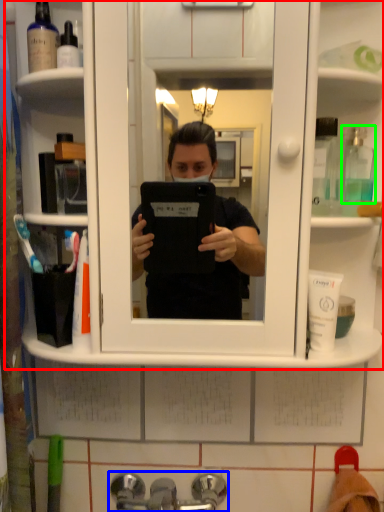
Question: Which is nearer to the cabinet (highlighted by a red box)? tap (highlighted by a blue box) or mouthwash (highlighted by a green box).

Choices:
 (A) tap
 (B) mouthwash

Answer: (B)